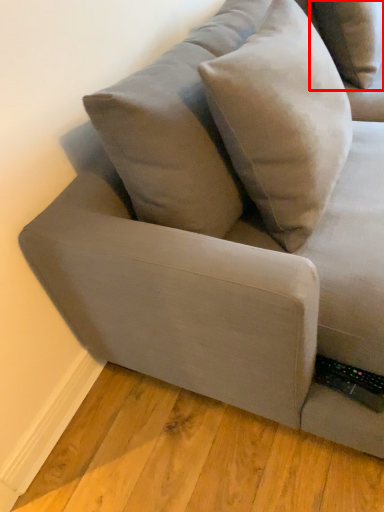
Question: Where is pillow (annotated by the red box) located in relation to throw pillow in the image?

Choices:
 (A) right
 (B) left

Answer: (A)